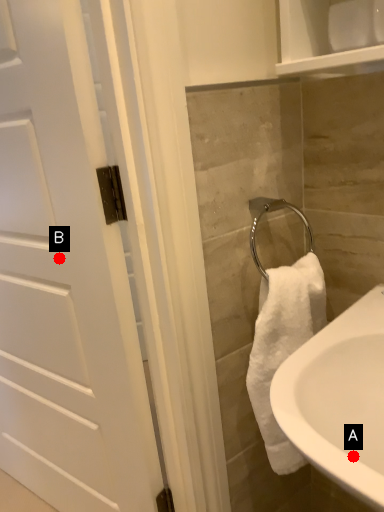
Question: Two points are circled on the image, labeled by A and B beside each circle. Which point is closer to the camera?

Choices:
 (A) A is closer
 (B) B is closer

Answer: (A)